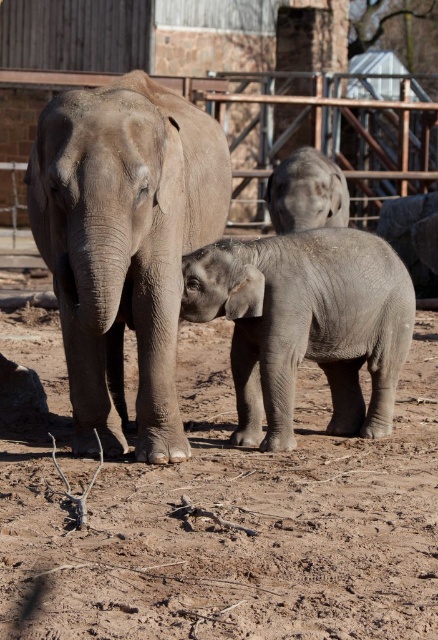
Can you confirm if brown sandy dirt at center is positioned to the right of gray matte elephant at center?

In fact, brown sandy dirt at center is to the left of gray matte elephant at center.

Is point (105, 509) positioned after point (293, 385)?

No, it is in front of (293, 385).

Locate an element on the screen. Image resolution: width=438 pixels, height=640 pixels. brown sandy dirt at center is located at coordinates (236, 522).

Is brown sandy dirt at center closer to the viewer compared to gray matte elephant at upper center?

Yes, brown sandy dirt at center is in front of gray matte elephant at upper center.

Between brown sandy dirt at center and gray matte elephant at upper center, which one has less height?

brown sandy dirt at center

This screenshot has width=438, height=640. In order to click on brown sandy dirt at center in this screenshot , I will do `click(236, 522)`.

Between metallic wire fence at upper center and gray matte elephant at upper center, which one is positioned higher?

metallic wire fence at upper center is higher up.

At what (x,y) coordinates should I click in order to perform the action: click on metallic wire fence at upper center. Please return your answer as a coordinate pair (x, y). The width and height of the screenshot is (438, 640). Looking at the image, I should click on (327, 129).

Who is more forward, (360, 148) or (307, 161)?

Positioned in front is point (307, 161).

Where is `metallic wire fence at upper center`? This screenshot has height=640, width=438. metallic wire fence at upper center is located at coordinates (327, 129).